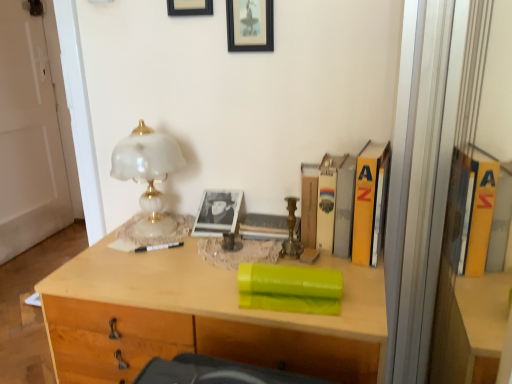
You are a GUI agent. You are given a task and a screenshot of the screen. Output one action in this format:
    pyautogui.click(x=<x>, y=<y>)
    Task: Click on the free space in front of white glass lamp at upper left
    The width and height of the screenshot is (512, 384).
    Given the screenshot: What is the action you would take?
    pyautogui.click(x=129, y=263)